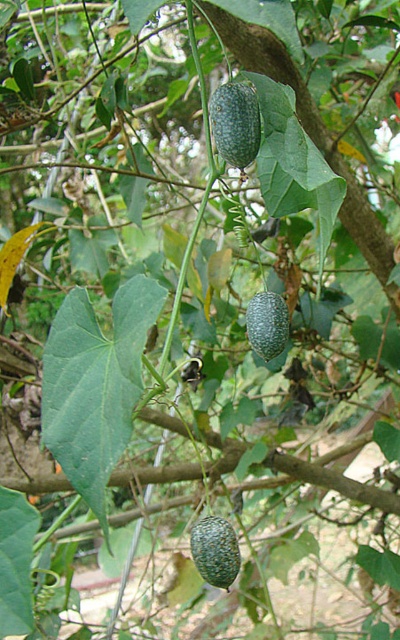
Is the position of green speckled gourd at center more distant than that of speckled green avocado at center?

Yes, green speckled gourd at center is behind speckled green avocado at center.

Is green speckled gourd at center to the right of speckled green avocado at center from the viewer's perspective?

Correct, you'll find green speckled gourd at center to the right of speckled green avocado at center.

Does point (227, 138) lie in front of point (220, 547)?

No.

The width and height of the screenshot is (400, 640). Find the location of `green speckled gourd at center`. green speckled gourd at center is located at coordinates (236, 124).

Does speckled green avocado at center have a greater width compared to green matte/glossy gourd at center?

In fact, speckled green avocado at center might be narrower than green matte/glossy gourd at center.

You are a GUI agent. You are given a task and a screenshot of the screen. Output one action in this format:
    pyautogui.click(x=<x>, y=<y>)
    Task: Click on the speckled green avocado at center
    The image size is (400, 640).
    Given the screenshot: What is the action you would take?
    pyautogui.click(x=214, y=550)

Does green speckled gourd at center appear over green matte/glossy gourd at center?

Correct, green speckled gourd at center is located above green matte/glossy gourd at center.

Looking at this image, who is more forward, (220, 156) or (275, 300)?

Point (220, 156) is in front.

Is point (256, 113) positioned after point (256, 301)?

No, it is not.

Where is `green speckled gourd at center`? This screenshot has height=640, width=400. green speckled gourd at center is located at coordinates (236, 124).